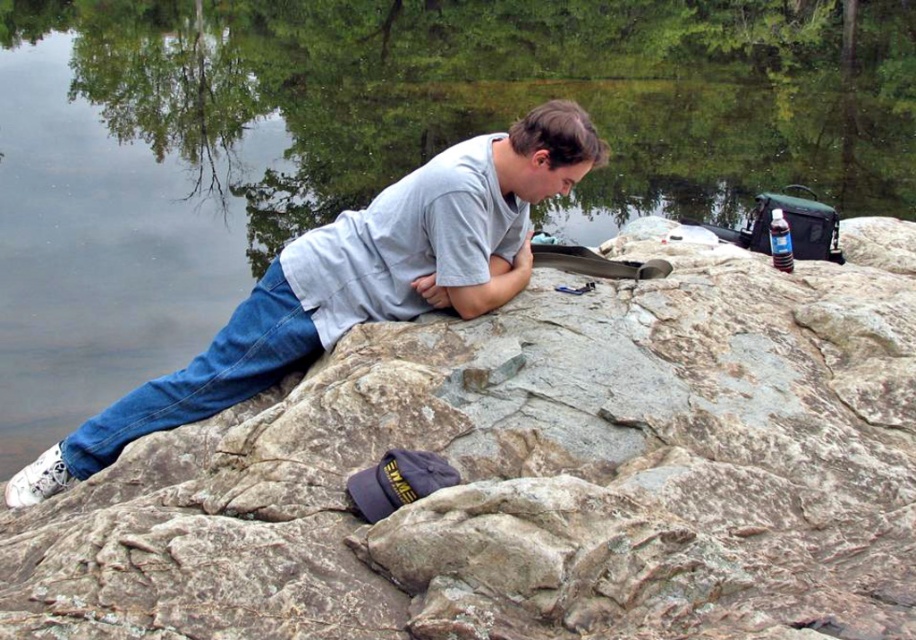
Is gray rough rock at center further to the viewer compared to gray cotton shirt at center?

No, it is not.

Is gray rough rock at center wider than gray cotton shirt at center?

Indeed, gray rough rock at center has a greater width compared to gray cotton shirt at center.

Between point (320, 544) and point (586, 115), which one is positioned behind?

Positioned behind is point (586, 115).

At what (x,y) coordinates should I click in order to perform the action: click on gray rough rock at center. Please return your answer as a coordinate pair (x, y). This screenshot has height=640, width=916. Looking at the image, I should click on (532, 474).